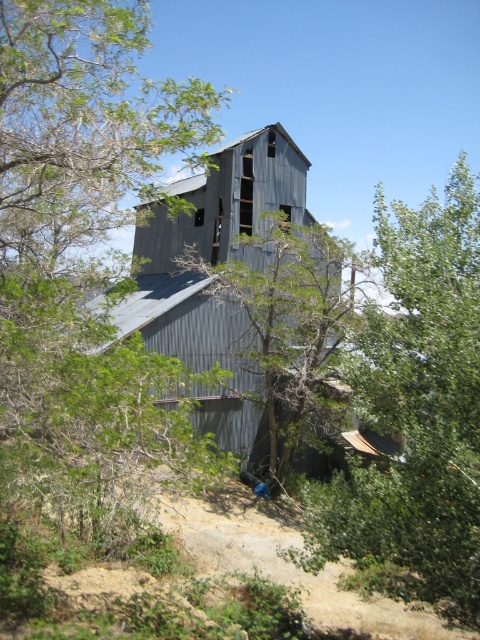
You are standing at the point labeled as point (212,276) in the image of an old silo. What is the surface material at that location?

The surface material at point (212,276) is rusty corrugated metal, as it is located on the rusty corrugated metal barn at center.

You are standing in front of the rusty corrugated metal barn at center and the green leafy tree at center. Which object is positioned to the right?

The green leafy tree at center is positioned to the right of the rusty corrugated metal barn at center.

You are a hiker who wants to take a photo of the rusty corrugated metal barn at center with the green leafy tree at right in the background. Can you stand close enough to the barn to include the tree in the frame without moving the tree or barn?

The distance between the green leafy tree at right and the rusty corrugated metal barn at center is 9.42 meters. Since the tree is 9.42 meters away from the barn, you can position yourself near the barn and still capture the tree in the background of your photo as long as your camera has a wide enough lens or zoom capability to include both in the frame.